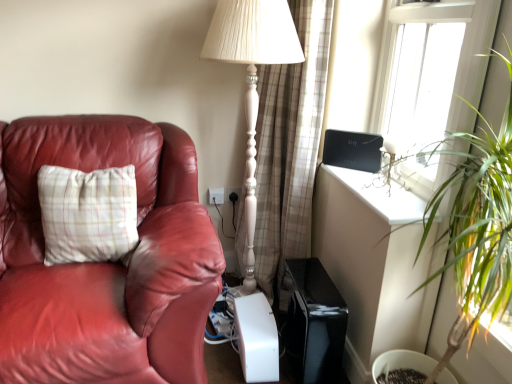
Question: Considering the relative sizes of plaid fabric curtain at center and white plastic electric outlet at lower center, arranged as the 2th electric outlet when viewed from the left, in the image provided, is plaid fabric curtain at center thinner than white plastic electric outlet at lower center, arranged as the 2th electric outlet when viewed from the left,?

Choices:
 (A) yes
 (B) no

Answer: (B)

Question: From the image's perspective, is plaid fabric curtain at center over white plastic electric outlet at lower center, arranged as the 2th electric outlet when viewed from the left?

Choices:
 (A) yes
 (B) no

Answer: (A)

Question: Is plaid fabric curtain at center further to camera compared to white plastic electric outlet at lower center, arranged as the 2th electric outlet when viewed from the left?

Choices:
 (A) no
 (B) yes

Answer: (A)

Question: From a real-world perspective, does plaid fabric curtain at center sit lower than white plastic electric outlet at lower center, arranged as the 2th electric outlet when viewed from the left?

Choices:
 (A) yes
 (B) no

Answer: (B)

Question: Is plaid fabric curtain at center outside white plastic electric outlet at lower center, which is counted as the first electric outlet, starting from the right?

Choices:
 (A) yes
 (B) no

Answer: (A)

Question: From the image's perspective, is plaid fabric pillow at left above or below white plastic electric outlet at lower center, which is counted as the first electric outlet, starting from the right?

Choices:
 (A) above
 (B) below

Answer: (B)

Question: Do you think plaid fabric pillow at left is within white plastic electric outlet at lower center, which is counted as the first electric outlet, starting from the right, or outside of it?

Choices:
 (A) outside
 (B) inside

Answer: (A)

Question: Relative to white plastic electric outlet at lower center, which is counted as the first electric outlet, starting from the right, is plaid fabric pillow at left in front or behind?

Choices:
 (A) behind
 (B) front

Answer: (B)

Question: Visually, is plaid fabric pillow at left positioned to the left or to the right of white plastic electric outlet at lower center, which is counted as the first electric outlet, starting from the right?

Choices:
 (A) right
 (B) left

Answer: (B)

Question: Is point [393, 23] closer or farther from the camera than point [509, 236]?

Choices:
 (A) farther
 (B) closer

Answer: (A)

Question: From the image's perspective, is transparent glass window at upper right located above or below green leafy plant at right?

Choices:
 (A) above
 (B) below

Answer: (A)

Question: From a real-world perspective, is transparent glass window at upper right positioned above or below green leafy plant at right?

Choices:
 (A) below
 (B) above

Answer: (B)

Question: Considering their positions, is transparent glass window at upper right located in front of or behind green leafy plant at right?

Choices:
 (A) behind
 (B) front

Answer: (A)

Question: Is green leafy plant at right to the left or to the right of white plastic electric outlet at lower center, the first electric outlet in the left-to-right sequence, in the image?

Choices:
 (A) left
 (B) right

Answer: (B)

Question: Considering the positions of point (494, 319) and point (214, 203), is point (494, 319) closer or farther from the camera than point (214, 203)?

Choices:
 (A) farther
 (B) closer

Answer: (B)